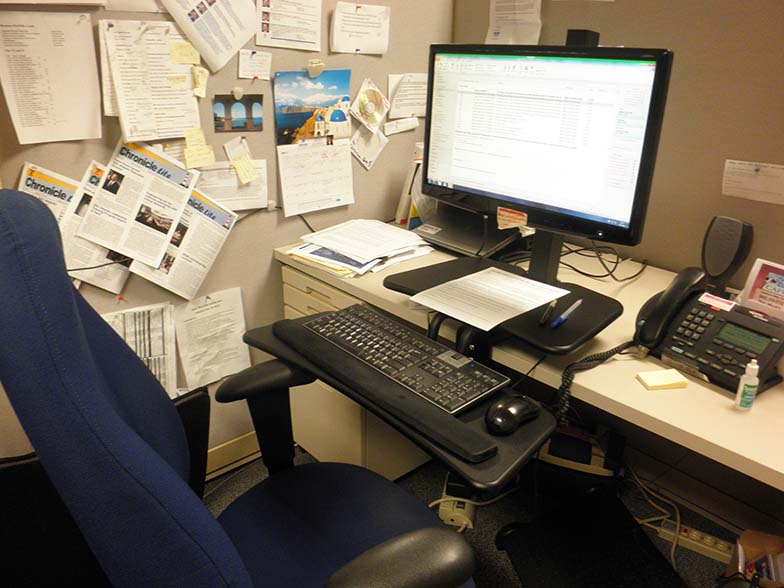
This screenshot has width=784, height=588. Identify the location of screen. (527, 101).